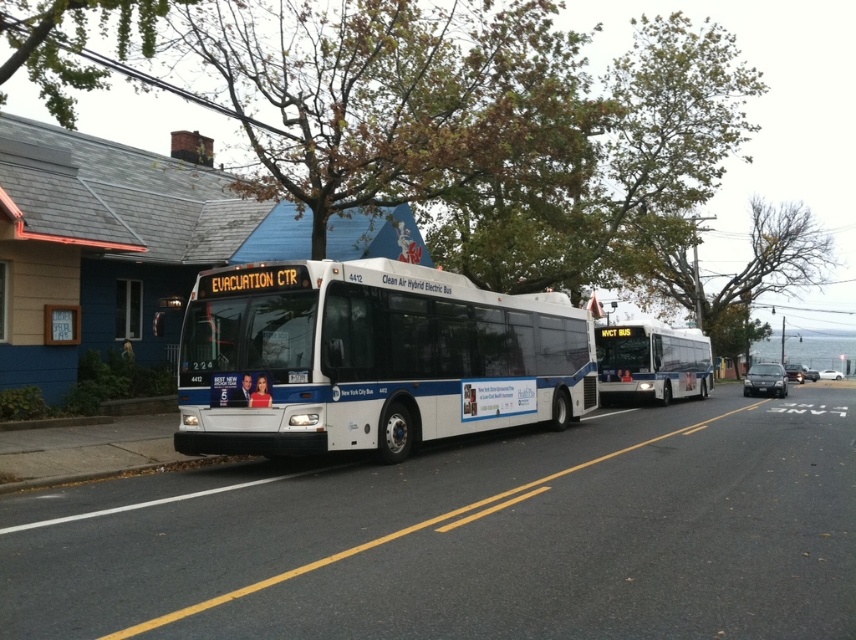
Question: Does white glossy bus at center have a smaller size compared to white matte bus at center?

Choices:
 (A) no
 (B) yes

Answer: (B)

Question: Which object appears closest to the camera in this image?

Choices:
 (A) white glossy bus at center
 (B) green leafy tree at upper center
 (C) white matte bus at center
 (D) bare branches at upper center

Answer: (B)

Question: Which of the following is the farthest from the observer?

Choices:
 (A) (640, 218)
 (B) (492, 358)
 (C) (599, 342)

Answer: (A)

Question: Is green leafy tree at upper center further to the viewer compared to white matte bus at center?

Choices:
 (A) no
 (B) yes

Answer: (A)

Question: Can you confirm if green leafy tree at upper center is wider than white matte bus at center?

Choices:
 (A) yes
 (B) no

Answer: (B)

Question: Which object is farther from the camera taking this photo?

Choices:
 (A) bare branches at upper center
 (B) white matte bus at center

Answer: (A)